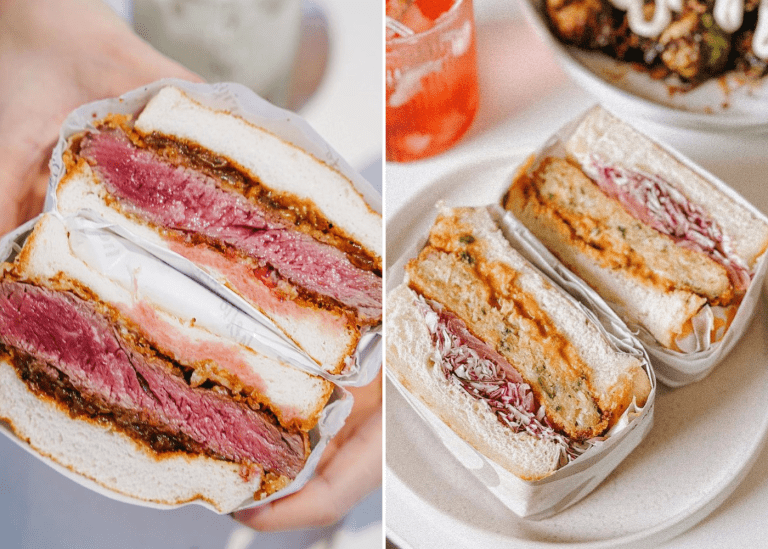
In order to click on plate in this screenshot , I will do `click(743, 116)`, `click(727, 399)`.